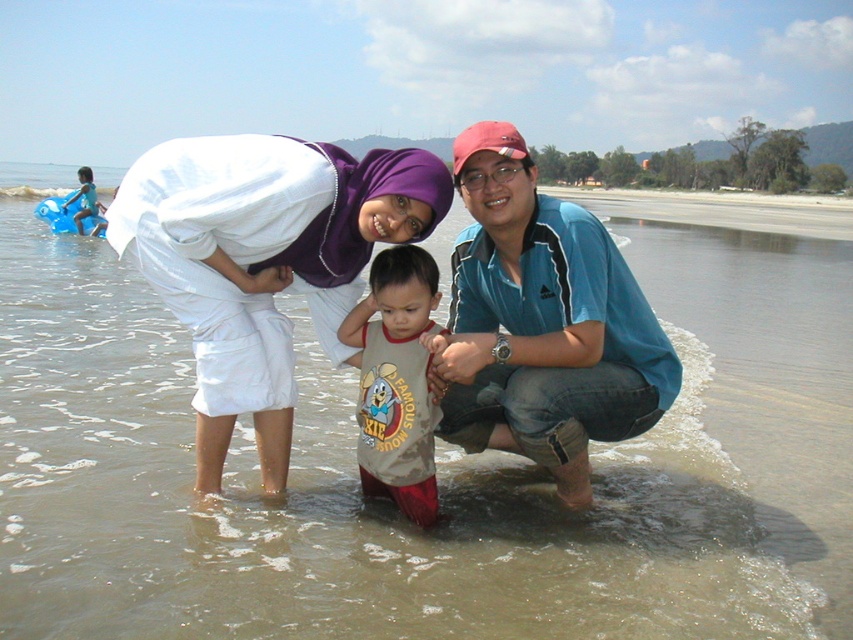
You are a photographer trying to capture a group photo of the blue cotton shirt at center and the light brown cotton shirt at center. The camera you are using has a minimum focusing distance of 30 centimeters. Will you be able to take the photo without moving either of the shirts?

The blue cotton shirt at center is 28.06 centimeters away from the light brown cotton shirt at center. Since the minimum focusing distance is 30 centimeters, the camera cannot focus properly at 28.06 centimeters. Therefore, you need to move the shirts further apart to at least 30 centimeters to take the photo.

You are planning to take a photo of the clear water at lower center and the white cotton hijab at upper left. Which object would require a wider angle to capture fully in the frame?

The clear water at lower center requires a wider angle to capture fully in the frame because it is larger in size than the white cotton hijab at upper left.

From the picture: You are a photographer trying to capture a group photo of the two people wearing blue cotton shirt at center and light brown cotton shirt at center. Since you want both shirts to be clearly visible in the photo, which shirt should you focus on to ensure the taller one is in focus?

The blue cotton shirt at center is taller than the light brown cotton shirt at center, so you should focus on the blue cotton shirt at center to ensure the taller one is in focus.